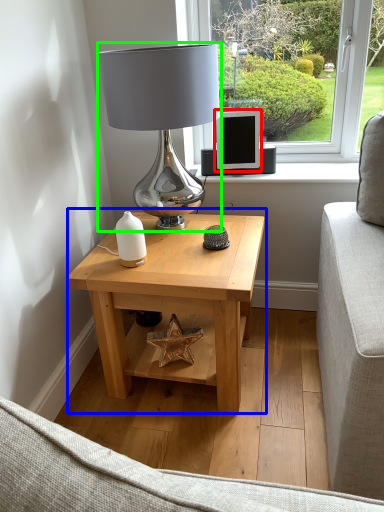
Question: Which object is the closest to the computer monitor (highlighted by a red box)? Choose among these: table (highlighted by a blue box) or table lamp (highlighted by a green box).

Choices:
 (A) table
 (B) table lamp

Answer: (B)